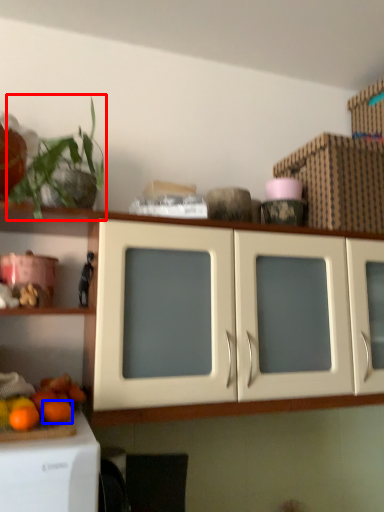
Question: Which object is closer to the camera taking this photo, plant (highlighted by a red box) or orange (highlighted by a blue box)?

Choices:
 (A) plant
 (B) orange

Answer: (A)